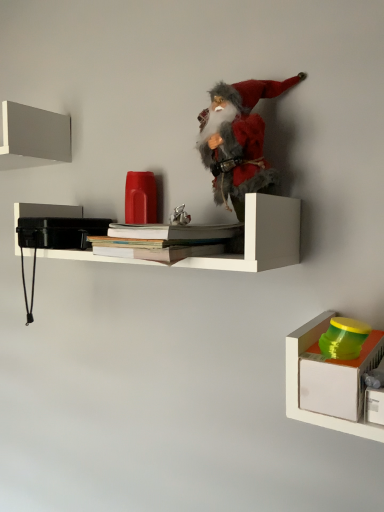
Question: From the image's perspective, is hardcover books at center, placed as the 1th book when sorted from bottom to top, beneath matte gray shelf at upper left, the first shelf positioned from the left?

Choices:
 (A) no
 (B) yes

Answer: (B)

Question: Considering the relative sizes of hardcover books at center, the second book viewed from the top, and matte gray shelf at upper left, acting as the first shelf starting from the top, in the image provided, is hardcover books at center, the second book viewed from the top, smaller than matte gray shelf at upper left, acting as the first shelf starting from the top,?

Choices:
 (A) yes
 (B) no

Answer: (A)

Question: Does hardcover books at center, placed as the 1th book when sorted from bottom to top, have a lesser height compared to matte gray shelf at upper left, which is the third shelf in bottom-to-top order?

Choices:
 (A) yes
 (B) no

Answer: (A)

Question: Is the depth of hardcover books at center, the second book viewed from the top, greater than that of matte gray shelf at upper left, the 3th shelf viewed from the right?

Choices:
 (A) yes
 (B) no

Answer: (B)

Question: Considering the relative sizes of hardcover books at center, placed as the 1th book when sorted from bottom to top, and matte gray shelf at upper left, which is the third shelf in bottom-to-top order, in the image provided, is hardcover books at center, placed as the 1th book when sorted from bottom to top, thinner than matte gray shelf at upper left, which is the third shelf in bottom-to-top order,?

Choices:
 (A) no
 (B) yes

Answer: (A)

Question: Considering the relative positions of hardcover books at center, the second book viewed from the top, and matte gray shelf at upper left, the first shelf positioned from the left, in the image provided, is hardcover books at center, the second book viewed from the top, to the right of matte gray shelf at upper left, the first shelf positioned from the left, from the viewer's perspective?

Choices:
 (A) no
 (B) yes

Answer: (B)

Question: Is white matte shelf at center, positioned as the 2th shelf in left-to-right order, beside fuzzy fabric santa at center, which ranks as the first toy in top-to-bottom order?

Choices:
 (A) no
 (B) yes

Answer: (A)

Question: Does white matte shelf at center, arranged as the 2th shelf when viewed from the top, appear on the right side of fuzzy fabric santa at center, the first toy from the left?

Choices:
 (A) yes
 (B) no

Answer: (B)

Question: Is white matte shelf at center, which is the 2th shelf from right to left, thinner than fuzzy fabric santa at center, the first toy from the left?

Choices:
 (A) no
 (B) yes

Answer: (A)

Question: Is white matte shelf at center, the 2th shelf positioned from the bottom, oriented towards fuzzy fabric santa at center, which ranks as the first toy in top-to-bottom order?

Choices:
 (A) yes
 (B) no

Answer: (B)

Question: Can you confirm if white matte shelf at center, which is the 2th shelf from right to left, is smaller than fuzzy fabric santa at center, the first toy from the left?

Choices:
 (A) yes
 (B) no

Answer: (B)

Question: Does white matte shelf at center, arranged as the 2th shelf when viewed from the top, lie in front of fuzzy fabric santa at center, the second toy from the bottom?

Choices:
 (A) no
 (B) yes

Answer: (B)

Question: Considering the relative positions of white matte shelf at center, which is the 2th shelf from right to left, and green plastic container at lower right, the first toy from the front, in the image provided, is white matte shelf at center, which is the 2th shelf from right to left, to the right of green plastic container at lower right, the first toy from the front, from the viewer's perspective?

Choices:
 (A) yes
 (B) no

Answer: (B)